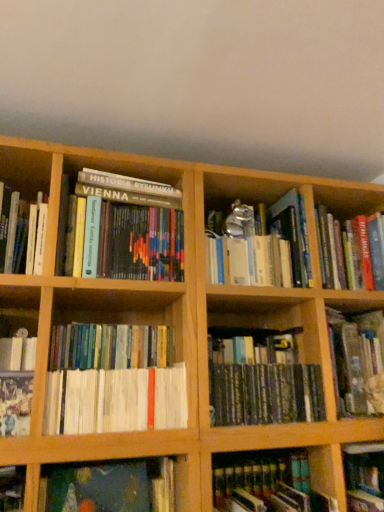
Question: Can you see hardcover book at lower right, acting as the 8th book starting from the left, touching white paperbacks at center, arranged as the 4th book when viewed from the left?

Choices:
 (A) no
 (B) yes

Answer: (A)

Question: Does hardcover book at lower right, which is the 2th book from right to left, appear on the left side of white paperbacks at center, arranged as the 4th book when viewed from the left?

Choices:
 (A) yes
 (B) no

Answer: (B)

Question: From a real-world perspective, is hardcover book at lower right, which is the 2th book from right to left, physically below white paperbacks at center, marked as the sixth book in a right-to-left arrangement?

Choices:
 (A) yes
 (B) no

Answer: (A)

Question: From the image's perspective, would you say hardcover book at lower right, which is the 2th book from right to left, is positioned over white paperbacks at center, arranged as the 4th book when viewed from the left?

Choices:
 (A) yes
 (B) no

Answer: (B)

Question: Is white paperbacks at center, marked as the sixth book in a right-to-left arrangement, at the back of hardcover book at lower right, acting as the 8th book starting from the left?

Choices:
 (A) yes
 (B) no

Answer: (B)

Question: Does hardcover book at lower right, acting as the 8th book starting from the left, have a greater height compared to white paperbacks at center, marked as the sixth book in a right-to-left arrangement?

Choices:
 (A) no
 (B) yes

Answer: (A)

Question: Could you tell me if hardcover book at lower left, which is counted as the 1th book, starting from the left, is facing hardcover book at center right, which appears as the 9th book when viewed from the left?

Choices:
 (A) yes
 (B) no

Answer: (B)

Question: Is hardcover book at lower left, positioned as the 9th book in right-to-left order, smaller than hardcover book at center right, which appears as the 9th book when viewed from the left?

Choices:
 (A) yes
 (B) no

Answer: (A)

Question: Considering the relative sizes of hardcover book at lower left, which is counted as the 1th book, starting from the left, and hardcover book at center right, which is the first book from right to left, in the image provided, is hardcover book at lower left, which is counted as the 1th book, starting from the left, shorter than hardcover book at center right, which is the first book from right to left,?

Choices:
 (A) yes
 (B) no

Answer: (A)

Question: Is hardcover book at lower left, which is counted as the 1th book, starting from the left, in front of hardcover book at center right, which appears as the 9th book when viewed from the left?

Choices:
 (A) yes
 (B) no

Answer: (A)

Question: Is hardcover book at lower left, positioned as the 9th book in right-to-left order, taller than hardcover book at center right, which appears as the 9th book when viewed from the left?

Choices:
 (A) no
 (B) yes

Answer: (A)

Question: Is hardcover book at lower left, which is counted as the 1th book, starting from the left, facing away from hardcover book at center right, which is the first book from right to left?

Choices:
 (A) no
 (B) yes

Answer: (A)

Question: Is hardcover book at center, the 6th book in the left-to-right sequence, to the left of white paperbacks at center, arranged as the 4th book when viewed from the left, from the viewer's perspective?

Choices:
 (A) yes
 (B) no

Answer: (B)